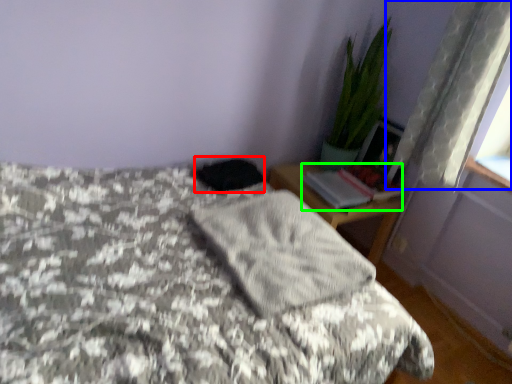
Question: Based on their relative distances, which object is nearer to dark (highlighted by a red box)? Choose from curtain (highlighted by a blue box) and book (highlighted by a green box).

Choices:
 (A) curtain
 (B) book

Answer: (B)